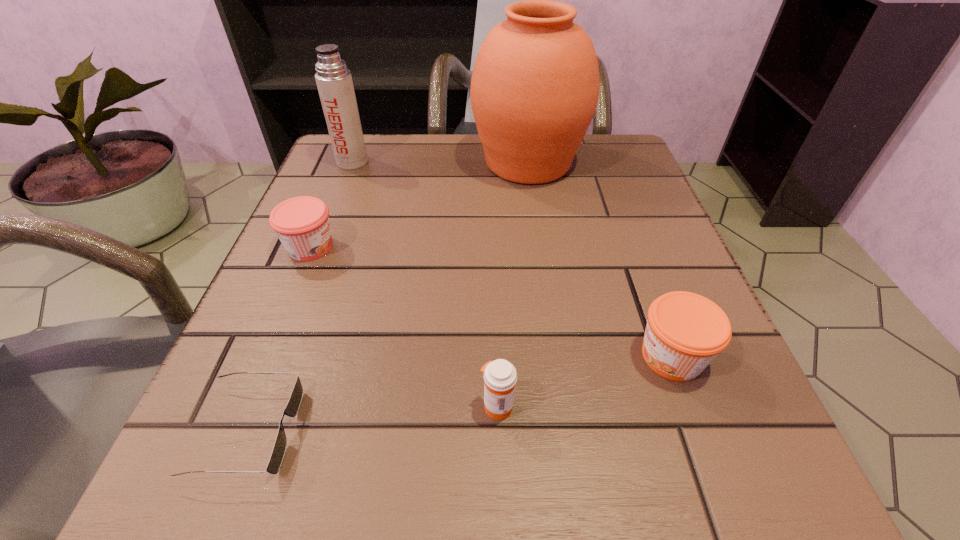
Locate an element on the screen. vacant region at the near right corner of the desktop is located at coordinates (714, 468).

You are a GUI agent. You are given a task and a screenshot of the screen. Output one action in this format:
    pyautogui.click(x=<x>, y=<y>)
    Task: Click on the blank region between the shortest object and the medicine
    The height and width of the screenshot is (540, 960).
    Given the screenshot: What is the action you would take?
    pyautogui.click(x=372, y=418)

Locate an element on the screen. The image size is (960, 540). free space between the medicine and the nearer jam is located at coordinates (585, 381).

Locate an element on the screen. The image size is (960, 540). free space between the thermos bottle and the right jam is located at coordinates (512, 259).

Identify the location of vacant region between the tallest object and the sunglasses. (388, 297).

Where is `blank region between the nearer jam and the medicine`? The width and height of the screenshot is (960, 540). blank region between the nearer jam and the medicine is located at coordinates (585, 381).

This screenshot has width=960, height=540. Identify the location of empty space that is in between the medicine and the urn. (513, 285).

The width and height of the screenshot is (960, 540). In order to click on vacant area that lies between the sunglasses and the nearer jam in this screenshot , I will do (x=460, y=394).

At what (x,y) coordinates should I click in order to perform the action: click on vacant space that is in between the sunglasses and the urn. Please return your answer as a coordinate pair (x, y). Looking at the image, I should click on (388, 297).

The height and width of the screenshot is (540, 960). What are the coordinates of `vacant space in between the sunglasses and the nearer jam` in the screenshot? It's located at (460, 394).